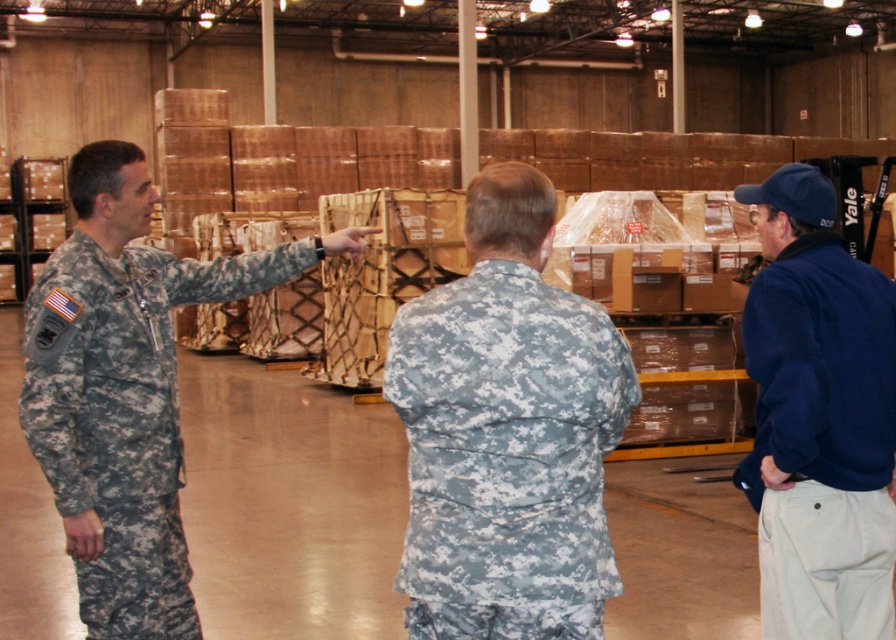
Between point (539, 355) and point (832, 416), which one is positioned behind?

Positioned behind is point (832, 416).

Between digital camouflage uniform at center and blue fleece jacket at right, which one appears on the right side from the viewer's perspective?

blue fleece jacket at right

The image size is (896, 640). What do you see at coordinates (506, 454) in the screenshot?
I see `digital camouflage uniform at center` at bounding box center [506, 454].

Locate an element on the screen. digital camouflage uniform at center is located at coordinates (506, 454).

Which is in front, point (536, 536) or point (164, 531)?

Positioned in front is point (536, 536).

Who is taller, digital camouflage uniform at center or camouflage fabric uniform at left?

camouflage fabric uniform at left

The height and width of the screenshot is (640, 896). Describe the element at coordinates (506, 454) in the screenshot. I see `digital camouflage uniform at center` at that location.

I want to click on digital camouflage uniform at center, so click(x=506, y=454).

Which is more to the right, blue fleece jacket at right or camouflage fabric uniform at left?

blue fleece jacket at right

Is point (851, 364) less distant than point (157, 273)?

That is True.

At what (x,y) coordinates should I click in order to perform the action: click on blue fleece jacket at right. Please return your answer as a coordinate pair (x, y). This screenshot has width=896, height=640. Looking at the image, I should click on (819, 419).